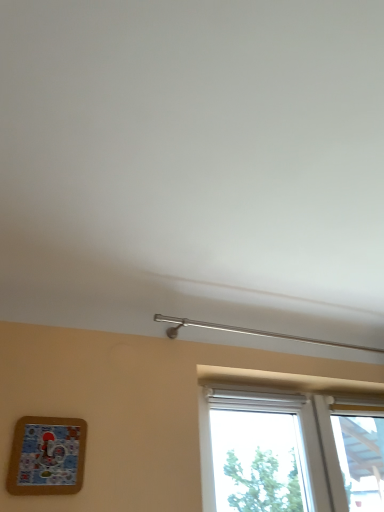
This screenshot has height=512, width=384. Describe the element at coordinates (290, 449) in the screenshot. I see `white plastic window at lower right` at that location.

The image size is (384, 512). I want to click on white plastic window at lower right, so click(x=290, y=449).

In order to face white plastic window at lower right, should I rotate leftwards or rightwards?

To face it directly, rotate right by 15.606 degrees.

What is the approximate width of white plastic window at lower right?

3.41 inches.

Consider the image. What is the approximate width of corkboard at lower left?

It is 0.91 inches.

Find the location of a particular element. Image resolution: width=384 pixels, height=512 pixels. corkboard at lower left is located at coordinates (47, 456).

What do you see at coordinates (47, 456) in the screenshot? I see `corkboard at lower left` at bounding box center [47, 456].

Measure the distance between corkboard at lower left and camera.

corkboard at lower left and camera are 3.56 feet apart.

Identify the location of white plastic window at lower right. The height and width of the screenshot is (512, 384). (290, 449).

Is white plastic window at lower right to the right of corkboard at lower left from the viewer's perspective?

Yes.

Looking at this image, is the position of white plastic window at lower right less distant than that of corkboard at lower left?

No, it is behind corkboard at lower left.

Which is in front, point (236, 421) or point (83, 460)?

The point (83, 460) is in front.

From the image's perspective, is white plastic window at lower right beneath corkboard at lower left?

Yes, from the image's perspective, white plastic window at lower right is below corkboard at lower left.

From a real-world perspective, is white plastic window at lower right positioned above or below corkboard at lower left?

white plastic window at lower right is situated higher than corkboard at lower left in the real world.

Considering the sizes of objects white plastic window at lower right and corkboard at lower left in the image provided, who is thinner, white plastic window at lower right or corkboard at lower left?

corkboard at lower left is thinner.

Can you confirm if white plastic window at lower right is taller than corkboard at lower left?

Correct, white plastic window at lower right is much taller as corkboard at lower left.

Looking at the image, does white plastic window at lower right seem bigger or smaller compared to corkboard at lower left?

Clearly, white plastic window at lower right is larger in size than corkboard at lower left.

Would you say white plastic window at lower right is inside or outside corkboard at lower left?

white plastic window at lower right is not inside corkboard at lower left, it's outside.

Would you say white plastic window at lower right is a long distance from corkboard at lower left?

Yes, white plastic window at lower right is far from corkboard at lower left.

Could you tell me if white plastic window at lower right is facing corkboard at lower left?

No, white plastic window at lower right does not turn towards corkboard at lower left.

How different are the orientations of white plastic window at lower right and corkboard at lower left in degrees?

The facing directions of white plastic window at lower right and corkboard at lower left are 0.495 degrees apart.

This screenshot has height=512, width=384. In order to click on picture frame that appears on the left of white plastic window at lower right in this screenshot , I will do `click(47, 456)`.

Is corkboard at lower left at the right side of white plastic window at lower right?

In fact, corkboard at lower left is to the left of white plastic window at lower right.

Between corkboard at lower left and white plastic window at lower right, which one is positioned behind?

white plastic window at lower right is more distant.

Does point (80, 445) lie in front of point (280, 391)?

Yes.

From the image's perspective, is corkboard at lower left above or below white plastic window at lower right?

Clearly, from the image's perspective, corkboard at lower left is above white plastic window at lower right.

From a real-world perspective, is corkboard at lower left over white plastic window at lower right?

Incorrect, from a real-world perspective, corkboard at lower left is lower than white plastic window at lower right.

From the picture: Is corkboard at lower left thinner than white plastic window at lower right?

Indeed, corkboard at lower left has a lesser width compared to white plastic window at lower right.

Considering the sizes of corkboard at lower left and white plastic window at lower right in the image, is corkboard at lower left taller or shorter than white plastic window at lower right?

In the image, corkboard at lower left appears to be shorter than white plastic window at lower right.

Between corkboard at lower left and white plastic window at lower right, which one has larger size?

With larger size is white plastic window at lower right.

Is corkboard at lower left not within white plastic window at lower right?

Yes, corkboard at lower left is outside of white plastic window at lower right.

Is there a large distance between corkboard at lower left and white plastic window at lower right?

Yes, corkboard at lower left and white plastic window at lower right are quite far apart.

Is white plastic window at lower right at the back of corkboard at lower left?

No, white plastic window at lower right is not at the back of corkboard at lower left.

Can you tell me how much corkboard at lower left and white plastic window at lower right differ in facing direction?

0.495 degrees.

In the scene shown: How far apart are corkboard at lower left and white plastic window at lower right?

6.78 feet.

Find the location of a particular element. The height and width of the screenshot is (512, 384). window located behind the corkboard at lower left is located at coordinates (290, 449).

At what (x,y) coordinates should I click in order to perform the action: click on picture frame that is above the white plastic window at lower right (from the image's perspective). Please return your answer as a coordinate pair (x, y). The height and width of the screenshot is (512, 384). Looking at the image, I should click on (47, 456).

This screenshot has height=512, width=384. Identify the location of picture frame below the white plastic window at lower right (from a real-world perspective). (47, 456).